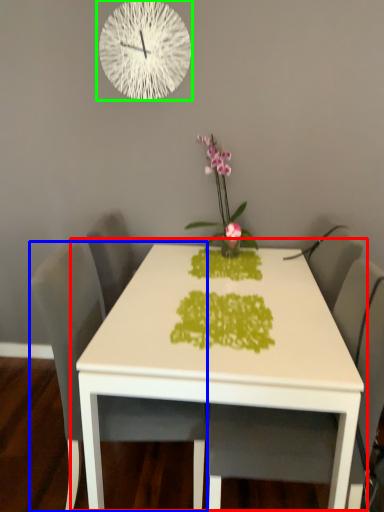
Question: Which object is the closest to the table (highlighted by a red box)? Choose among these: chair (highlighted by a blue box) or wall clock (highlighted by a green box).

Choices:
 (A) chair
 (B) wall clock

Answer: (A)